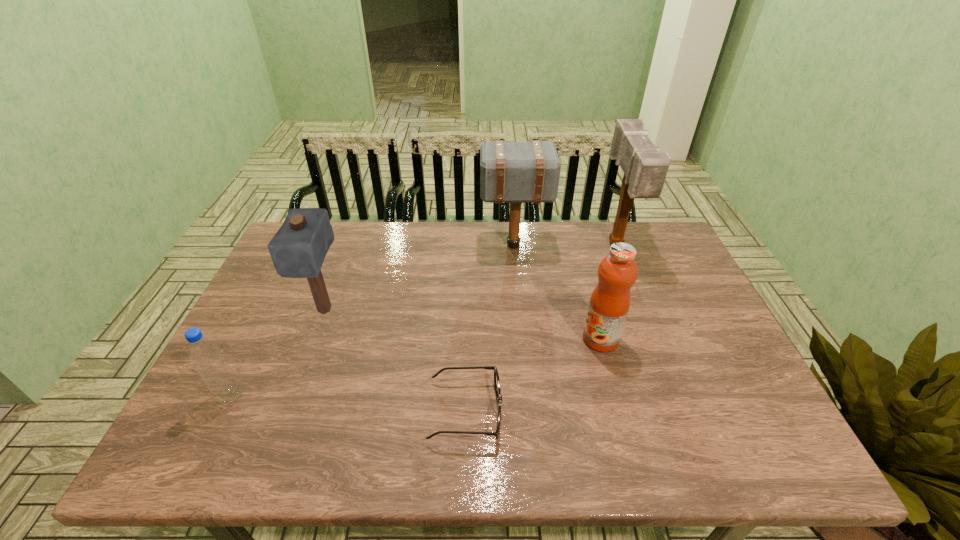
Identify which mallet is located as the third nearest to the second object from right to left. Please provide its 2D coordinates. Your answer should be formatted as a tuple, i.e. [(x, y)], where the tuple contains the x and y coordinates of a point satisfying the conditions above.

[(298, 249)]

Identify which mallet is the second nearest to the rightmost object. Please provide its 2D coordinates. Your answer should be formatted as a tuple, i.e. [(x, y)], where the tuple contains the x and y coordinates of a point satisfying the conditions above.

[(298, 249)]

At what (x,y) coordinates should I click in order to perform the action: click on vacant point that satisfies the following two spatial constraints: 1. on the striking surface of the rightmost object; 2. on the left side of the second mallet from right to left. Please return your answer as a coordinate pair (x, y). Looking at the image, I should click on (514, 246).

Where is `free spot that satisfies the following two spatial constraints: 1. on the front label of the fifth object from left to right; 2. on the front side of the water bottle`? This screenshot has height=540, width=960. free spot that satisfies the following two spatial constraints: 1. on the front label of the fifth object from left to right; 2. on the front side of the water bottle is located at coordinates (616, 396).